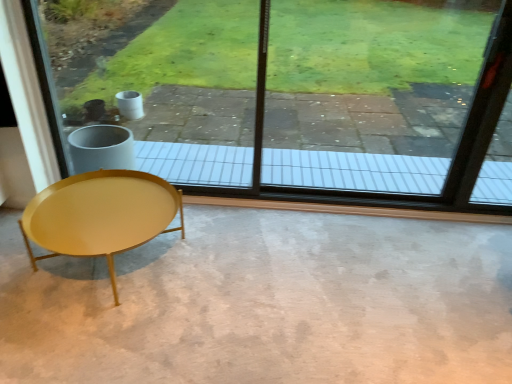
Locate an element on the screen. The image size is (512, 384). free space in front of shiny gold coffee table at lower left is located at coordinates (96, 337).